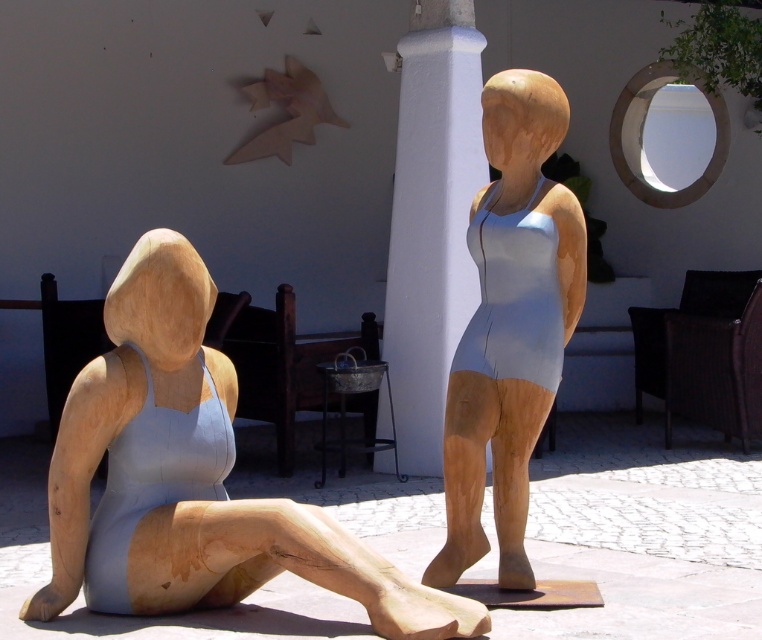
Question: Which point is farther from the camera taking this photo?

Choices:
 (A) (447, 374)
 (B) (546, 352)
 (C) (412, 595)

Answer: (A)

Question: Among these objects, which one is farthest from the camera?

Choices:
 (A) white painted pillar at center
 (B) matte wood figure at left

Answer: (A)

Question: Is matte wood figure at left to the left of white painted pillar at center from the viewer's perspective?

Choices:
 (A) yes
 (B) no

Answer: (A)

Question: Is matte wood statue at center above white painted pillar at center?

Choices:
 (A) no
 (B) yes

Answer: (A)

Question: Is matte wood figure at left positioned behind matte wood statue at center?

Choices:
 (A) no
 (B) yes

Answer: (A)

Question: Which point appears closest to the camera in this image?

Choices:
 (A) pyautogui.click(x=469, y=3)
 (B) pyautogui.click(x=101, y=445)
 (C) pyautogui.click(x=530, y=259)

Answer: (B)